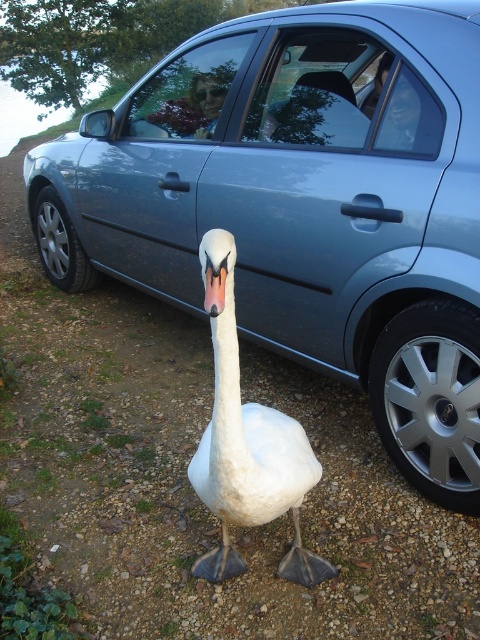
From the picture: You are standing 10 feet away from the silver metallic wheel at lower right. If you want to touch it, do you need to move closer?

The silver metallic wheel at lower right is 7.58 feet away from the viewer. Since you are currently 10 feet away, you need to move closer to reach it.

You are standing at the origin point of the image. A point is marked at coordinates (249, 451). Based on the scene description, what object is located at that point?

The point at coordinates (249, 451) indicates the location of the white feathered swan at center.

You are a delivery person who needs to approach the white feathered swan at center to deliver a package. The silver metallic tire at left is blocking your path. Can you walk around the tire to reach the swan without getting too close to the tire?

The white feathered swan at center is 3.22 meters away from the silver metallic tire at left. Since the tire is only blocking part of the path, you can walk around it while maintaining a safe distance of approximately 3.22 meters between yourself and the tire to reach the swan.